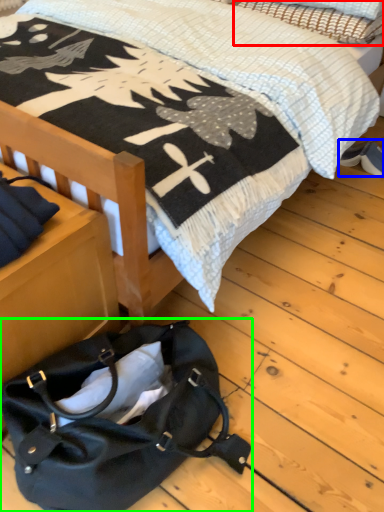
Question: Based on their relative distances, which object is farther from pillow (highlighted by a red box)? Choose from footwear (highlighted by a blue box) and handbag (highlighted by a green box).

Choices:
 (A) footwear
 (B) handbag

Answer: (B)